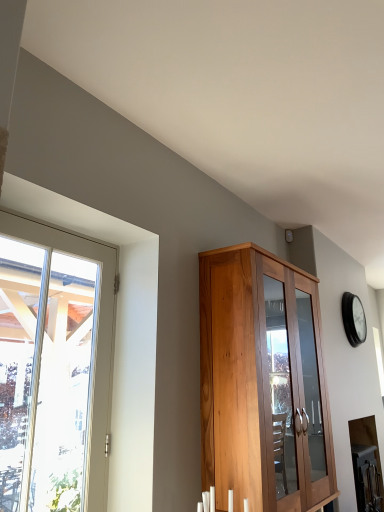
Question: Is wooden cabinet at center further to the viewer compared to black glass clock at upper right?

Choices:
 (A) no
 (B) yes

Answer: (A)

Question: Is wooden cabinet at center not within black glass clock at upper right?

Choices:
 (A) yes
 (B) no

Answer: (A)

Question: Are wooden cabinet at center and black glass clock at upper right far apart?

Choices:
 (A) no
 (B) yes

Answer: (B)

Question: Does wooden cabinet at center have a lesser height compared to black glass clock at upper right?

Choices:
 (A) yes
 (B) no

Answer: (B)

Question: From a real-world perspective, is wooden cabinet at center located beneath black glass clock at upper right?

Choices:
 (A) yes
 (B) no

Answer: (A)

Question: Is wooden cabinet at center smaller than black glass clock at upper right?

Choices:
 (A) no
 (B) yes

Answer: (A)

Question: From the image's perspective, does black glass clock at upper right appear higher than wooden cabinet at center?

Choices:
 (A) yes
 (B) no

Answer: (A)

Question: Can you confirm if black glass clock at upper right is thinner than wooden cabinet at center?

Choices:
 (A) yes
 (B) no

Answer: (A)

Question: Does black glass clock at upper right lie behind wooden cabinet at center?

Choices:
 (A) yes
 (B) no

Answer: (A)

Question: Is black glass clock at upper right shorter than wooden cabinet at center?

Choices:
 (A) yes
 (B) no

Answer: (A)

Question: From a real-world perspective, is black glass clock at upper right positioned over wooden cabinet at center based on gravity?

Choices:
 (A) yes
 (B) no

Answer: (A)

Question: Is black glass clock at upper right positioned before wooden cabinet at center?

Choices:
 (A) no
 (B) yes

Answer: (A)

Question: Is clear glass window at left located outside wooden cabinet at center?

Choices:
 (A) yes
 (B) no

Answer: (A)